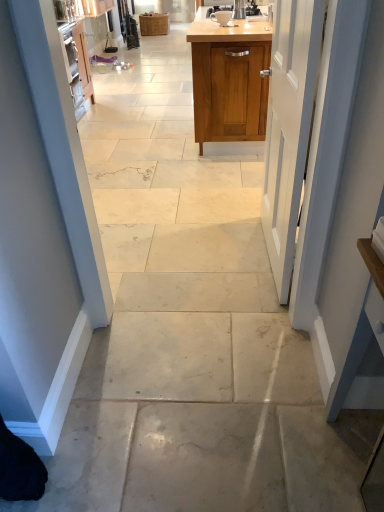
Measure the distance between wooden cabinet at upper center, which is counted as the 2th cabinetry, starting from the back, and camera.

wooden cabinet at upper center, which is counted as the 2th cabinetry, starting from the back, is 2.96 meters from camera.

Describe the element at coordinates (289, 128) in the screenshot. This screenshot has width=384, height=512. I see `white painted wood door at center` at that location.

Measure the distance between point (224, 13) and camera.

Point (224, 13) is 4.04 meters away from camera.

The height and width of the screenshot is (512, 384). What are the coordinates of `wooden cabinet at upper center, acting as the first cabinetry starting from the front` in the screenshot? It's located at (229, 80).

Is white painted wood door at center bigger than wooden cabinet at center, positioned as the 2th cabinetry in right-to-left order?

Indeed, white painted wood door at center has a larger size compared to wooden cabinet at center, positioned as the 2th cabinetry in right-to-left order.

From the image's perspective, who appears lower, white painted wood door at center or wooden cabinet at center, which is counted as the 2th cabinetry, starting from the front?

white painted wood door at center appears lower in the image.

Between white painted wood door at center and wooden cabinet at center, positioned as the 2th cabinetry in right-to-left order, which one appears on the right side from the viewer's perspective?

From the viewer's perspective, white painted wood door at center appears more on the right side.

Is wooden cabinet at center, placed as the 1th cabinetry when sorted from top to bottom, a part of wooden cabinet at upper center, the 2th cabinetry viewed from the left?

That's incorrect, wooden cabinet at center, placed as the 1th cabinetry when sorted from top to bottom, is not inside wooden cabinet at upper center, the 2th cabinetry viewed from the left.

Is wooden cabinet at upper center, the first cabinetry positioned from the bottom, thinner than wooden cabinet at center, which is counted as the 2th cabinetry, starting from the front?

Incorrect, the width of wooden cabinet at upper center, the first cabinetry positioned from the bottom, is not less than that of wooden cabinet at center, which is counted as the 2th cabinetry, starting from the front.

Is wooden cabinet at upper center, the first cabinetry positioned from the bottom, positioned behind wooden cabinet at center, positioned as the first cabinetry in left-to-right order?

No.

Can you confirm if wooden cabinet at upper center, the first cabinetry positioned from the bottom, is positioned to the right of wooden cabinet at center, placed as the 1th cabinetry when sorted from top to bottom?

Correct, you'll find wooden cabinet at upper center, the first cabinetry positioned from the bottom, to the right of wooden cabinet at center, placed as the 1th cabinetry when sorted from top to bottom.

Is white painted wood door at center positioned with its back to wooden cabinet at upper center, which is counted as the 2th cabinetry, starting from the back?

No, white painted wood door at center is not facing away from wooden cabinet at upper center, which is counted as the 2th cabinetry, starting from the back.

Considering the sizes of objects white painted wood door at center and wooden cabinet at upper center, acting as the first cabinetry starting from the front, in the image provided, who is smaller, white painted wood door at center or wooden cabinet at upper center, acting as the first cabinetry starting from the front,?

With smaller size is white painted wood door at center.

From the image's perspective, who appears lower, white painted wood door at center or wooden cabinet at upper center, which is counted as the 2th cabinetry, starting from the back?

From the image's view, white painted wood door at center is below.

Is white painted wood door at center located outside wooden cabinet at upper center, which is counted as the 2th cabinetry, starting from the back?

white painted wood door at center is positioned outside wooden cabinet at upper center, which is counted as the 2th cabinetry, starting from the back.

Which is behind, point (229, 12) or point (267, 203)?

The point (229, 12) is farther.

Is matte ceramic coffee cup at upper center at the right side of white painted wood door at center?

Incorrect, matte ceramic coffee cup at upper center is not on the right side of white painted wood door at center.

Identify the location of door located below the matte ceramic coffee cup at upper center (from the image's perspective). (289, 128).

Is matte ceramic coffee cup at upper center located outside wooden cabinet at center, positioned as the 2th cabinetry in right-to-left order?

Absolutely, matte ceramic coffee cup at upper center is external to wooden cabinet at center, positioned as the 2th cabinetry in right-to-left order.

Is matte ceramic coffee cup at upper center facing away from wooden cabinet at center, positioned as the first cabinetry in left-to-right order?

No, matte ceramic coffee cup at upper center's orientation is not away from wooden cabinet at center, positioned as the first cabinetry in left-to-right order.

Is matte ceramic coffee cup at upper center wider or thinner than wooden cabinet at center, the second cabinetry in the bottom-to-top sequence?

In the image, matte ceramic coffee cup at upper center appears to be more narrow than wooden cabinet at center, the second cabinetry in the bottom-to-top sequence.

Relative to wooden cabinet at center, placed as the 1th cabinetry when sorted from top to bottom, is matte ceramic coffee cup at upper center in front or behind?

Clearly, matte ceramic coffee cup at upper center is in front of wooden cabinet at center, placed as the 1th cabinetry when sorted from top to bottom.

Is matte ceramic coffee cup at upper center behind wooden cabinet at upper center, arranged as the 1th cabinetry when viewed from the right?

Yes, matte ceramic coffee cup at upper center is further from the viewer.

Which of these two, matte ceramic coffee cup at upper center or wooden cabinet at upper center, the 2th cabinetry viewed from the left, stands taller?

wooden cabinet at upper center, the 2th cabinetry viewed from the left.

Image resolution: width=384 pixels, height=512 pixels. What are the coordinates of `appliance above the wooden cabinet at upper center, the second cabinetry when ordered from top to bottom (from a real-world perspective)` in the screenshot? It's located at (222, 17).

From a real-world perspective, is matte ceramic coffee cup at upper center physically above wooden cabinet at upper center, which is counted as the 2th cabinetry, starting from the back?

Yes, from a real-world perspective, matte ceramic coffee cup at upper center is over wooden cabinet at upper center, which is counted as the 2th cabinetry, starting from the back

From the picture: In the image, is wooden cabinet at center, placed as the 1th cabinetry when sorted from top to bottom, positioned in front of or behind wooden cabinet at upper center, acting as the first cabinetry starting from the front?

Visually, wooden cabinet at center, placed as the 1th cabinetry when sorted from top to bottom, is located behind wooden cabinet at upper center, acting as the first cabinetry starting from the front.

From the image's perspective, does wooden cabinet at center, positioned as the first cabinetry in left-to-right order, appear lower than wooden cabinet at upper center, which is counted as the 2th cabinetry, starting from the back?

Incorrect, from the image's perspective, wooden cabinet at center, positioned as the first cabinetry in left-to-right order, is higher than wooden cabinet at upper center, which is counted as the 2th cabinetry, starting from the back.

Looking at this image, is wooden cabinet at center, the first cabinetry when ordered from back to front, beside wooden cabinet at upper center, the first cabinetry positioned from the bottom?

There is a gap between wooden cabinet at center, the first cabinetry when ordered from back to front, and wooden cabinet at upper center, the first cabinetry positioned from the bottom.

This screenshot has width=384, height=512. What are the coordinates of `cabinetry on the left of the wooden cabinet at upper center, the second cabinetry when ordered from top to bottom` in the screenshot? It's located at (154, 24).

Where is `door lying on the right of wooden cabinet at center, placed as the 1th cabinetry when sorted from top to bottom`? The height and width of the screenshot is (512, 384). door lying on the right of wooden cabinet at center, placed as the 1th cabinetry when sorted from top to bottom is located at coordinates (289, 128).

Find the location of `cabinetry that is behind the wooden cabinet at upper center, the 2th cabinetry viewed from the left`. cabinetry that is behind the wooden cabinet at upper center, the 2th cabinetry viewed from the left is located at coordinates (154, 24).

Estimate the real-world distances between objects in this image. Which object is further from wooden cabinet at upper center, the first cabinetry positioned from the bottom, wooden cabinet at center, placed as the 1th cabinetry when sorted from top to bottom, or white painted wood door at center?

Based on the image, wooden cabinet at center, placed as the 1th cabinetry when sorted from top to bottom, appears to be further to wooden cabinet at upper center, the first cabinetry positioned from the bottom.

When comparing their distances from wooden cabinet at center, the second cabinetry in the bottom-to-top sequence, does matte ceramic coffee cup at upper center or wooden cabinet at upper center, which is counted as the 2th cabinetry, starting from the back, seem further?

The object further to wooden cabinet at center, the second cabinetry in the bottom-to-top sequence, is wooden cabinet at upper center, which is counted as the 2th cabinetry, starting from the back.

In the scene shown: Looking at the image, which one is located closer to wooden cabinet at center, placed as the 1th cabinetry when sorted from top to bottom, matte ceramic coffee cup at upper center or white painted wood door at center?

Among the two, matte ceramic coffee cup at upper center is located nearer to wooden cabinet at center, placed as the 1th cabinetry when sorted from top to bottom.

Based on their spatial positions, is white painted wood door at center or matte ceramic coffee cup at upper center further from wooden cabinet at center, positioned as the first cabinetry in left-to-right order?

The object further to wooden cabinet at center, positioned as the first cabinetry in left-to-right order, is white painted wood door at center.

Looking at the image, which one is located closer to wooden cabinet at center, positioned as the 2th cabinetry in right-to-left order, white painted wood door at center or wooden cabinet at upper center, the first cabinetry positioned from the bottom?

Based on the image, wooden cabinet at upper center, the first cabinetry positioned from the bottom, appears to be nearer to wooden cabinet at center, positioned as the 2th cabinetry in right-to-left order.

From the image, which object appears to be nearer to white painted wood door at center, matte ceramic coffee cup at upper center or wooden cabinet at upper center, which is counted as the 2th cabinetry, starting from the back?

The object closer to white painted wood door at center is wooden cabinet at upper center, which is counted as the 2th cabinetry, starting from the back.

Looking at the image, which one is located closer to matte ceramic coffee cup at upper center, wooden cabinet at upper center, arranged as the 1th cabinetry when viewed from the right, or wooden cabinet at center, positioned as the first cabinetry in left-to-right order?

The object closer to matte ceramic coffee cup at upper center is wooden cabinet at upper center, arranged as the 1th cabinetry when viewed from the right.

Consider the image. When comparing their distances from matte ceramic coffee cup at upper center, does wooden cabinet at center, placed as the 1th cabinetry when sorted from top to bottom, or wooden cabinet at upper center, the second cabinetry when ordered from top to bottom, seem further?

wooden cabinet at center, placed as the 1th cabinetry when sorted from top to bottom, is positioned further to the anchor matte ceramic coffee cup at upper center.

Locate an element on the screen. appliance between white painted wood door at center and wooden cabinet at center, placed as the 1th cabinetry when sorted from top to bottom, in the front-back direction is located at coordinates (222, 17).

What are the coordinates of `appliance between wooden cabinet at upper center, acting as the first cabinetry starting from the front, and wooden cabinet at center, which is counted as the 2th cabinetry, starting from the front, in the front-back direction` in the screenshot? It's located at (222, 17).

The height and width of the screenshot is (512, 384). What are the coordinates of `cabinetry located between white painted wood door at center and matte ceramic coffee cup at upper center in the depth direction` in the screenshot? It's located at (229, 80).

You are a GUI agent. You are given a task and a screenshot of the screen. Output one action in this format:
    pyautogui.click(x=<x>, y=<y>)
    Task: Click on the cabinetry between white painted wood door at center and wooden cabinet at center, the second cabinetry in the bottom-to-top sequence, from front to back
    This screenshot has height=512, width=384.
    Given the screenshot: What is the action you would take?
    pyautogui.click(x=229, y=80)